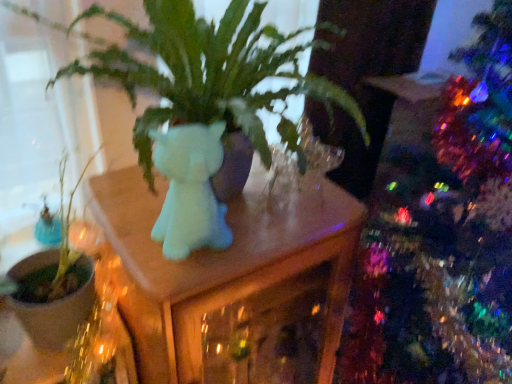
Question: Is matte white unicorn at center to the left of matte white cat at center from the viewer's perspective?

Choices:
 (A) yes
 (B) no

Answer: (B)

Question: Considering the relative sizes of matte white unicorn at center and matte white cat at center in the image provided, is matte white unicorn at center smaller than matte white cat at center?

Choices:
 (A) yes
 (B) no

Answer: (B)

Question: Is matte white cat at center inside matte white unicorn at center?

Choices:
 (A) yes
 (B) no

Answer: (B)

Question: Is matte white unicorn at center positioned far away from matte white cat at center?

Choices:
 (A) yes
 (B) no

Answer: (B)

Question: Is matte white unicorn at center oriented away from matte white cat at center?

Choices:
 (A) yes
 (B) no

Answer: (B)

Question: Does matte white unicorn at center have a greater height compared to matte white cat at center?

Choices:
 (A) yes
 (B) no

Answer: (A)

Question: Is green matte plant at left positioned beyond the bounds of matte white cat at center?

Choices:
 (A) no
 (B) yes

Answer: (B)

Question: Considering the relative sizes of green matte plant at left and matte white cat at center in the image provided, is green matte plant at left smaller than matte white cat at center?

Choices:
 (A) yes
 (B) no

Answer: (B)

Question: From the image's perspective, is green matte plant at left below matte white cat at center?

Choices:
 (A) yes
 (B) no

Answer: (A)

Question: Considering the relative positions of green matte plant at left and matte white cat at center in the image provided, is green matte plant at left to the left of matte white cat at center from the viewer's perspective?

Choices:
 (A) yes
 (B) no

Answer: (A)

Question: Is green matte plant at left thinner than matte white cat at center?

Choices:
 (A) yes
 (B) no

Answer: (B)

Question: Is green matte plant at left placed right next to matte white cat at center?

Choices:
 (A) yes
 (B) no

Answer: (B)

Question: From the image's perspective, is matte white unicorn at center beneath green matte plant at left?

Choices:
 (A) no
 (B) yes

Answer: (B)